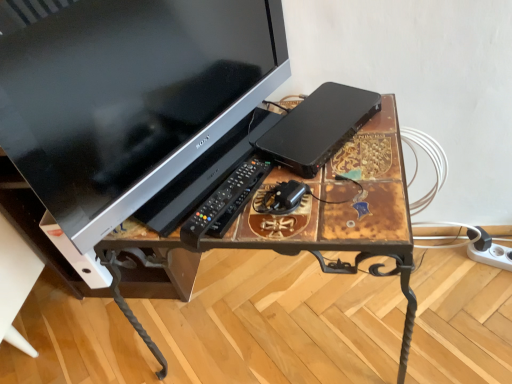
Find the location of `empty space that is in between black plastic remote at center and black plastic power adapter at center`. empty space that is in between black plastic remote at center and black plastic power adapter at center is located at coordinates (262, 211).